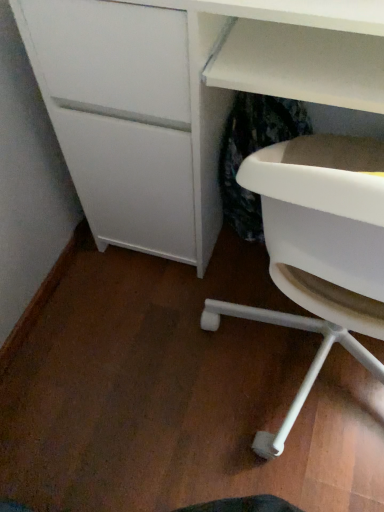
Question: Is white matte chair at lower right inside white matte desk at center?

Choices:
 (A) no
 (B) yes

Answer: (A)

Question: Is white matte desk at center not within white matte chair at lower right?

Choices:
 (A) no
 (B) yes

Answer: (B)

Question: Is white matte desk at center to the left of white matte chair at lower right from the viewer's perspective?

Choices:
 (A) no
 (B) yes

Answer: (B)

Question: Is white matte desk at center far away from white matte chair at lower right?

Choices:
 (A) no
 (B) yes

Answer: (A)

Question: Is white matte desk at center in contact with white matte chair at lower right?

Choices:
 (A) yes
 (B) no

Answer: (B)

Question: Is white matte desk at center positioned behind white matte chair at lower right?

Choices:
 (A) no
 (B) yes

Answer: (B)

Question: Does white matte chair at lower right have a smaller size compared to white matte desk at center?

Choices:
 (A) yes
 (B) no

Answer: (A)

Question: From a real-world perspective, is white matte chair at lower right located beneath white matte desk at center?

Choices:
 (A) no
 (B) yes

Answer: (A)

Question: Is white matte chair at lower right surrounding white matte desk at center?

Choices:
 (A) yes
 (B) no

Answer: (B)

Question: Is white matte chair at lower right at the right side of white matte desk at center?

Choices:
 (A) no
 (B) yes

Answer: (B)

Question: Does white matte chair at lower right have a larger size compared to white matte desk at center?

Choices:
 (A) no
 (B) yes

Answer: (A)

Question: Considering the relative sizes of white matte chair at lower right and white matte desk at center in the image provided, is white matte chair at lower right wider than white matte desk at center?

Choices:
 (A) no
 (B) yes

Answer: (A)

Question: From the image's perspective, relative to white matte desk at center, is white matte chair at lower right above or below?

Choices:
 (A) below
 (B) above

Answer: (A)